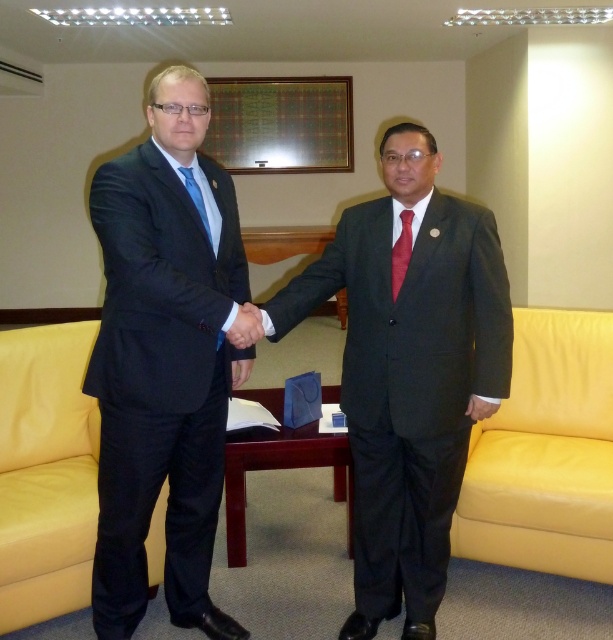
Looking at this image, you are a photographer in the room and want to take a photo of the dark gray suit at center and the matte blue tie at left. To ensure both are in frame, should you position the camera to the left or right of the two men?

You should position the camera to the right of the two men because the dark gray suit at center is to the right of the matte blue tie at left, so placing the camera on the right side will keep both in the frame.

Looking at this image, you are standing in the office and need to hand a document to the person wearing the black matte suit at left and the dark gray suit at center. Which one should you approach first based on their positions?

You should approach the black matte suit at left first because it is closer to you than the dark gray suit at center.